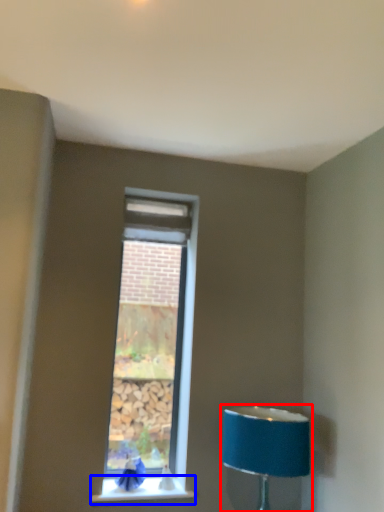
Question: Which point is further to the camera, lamp (highlighted by a red box) or window sill (highlighted by a blue box)?

Choices:
 (A) lamp
 (B) window sill

Answer: (B)